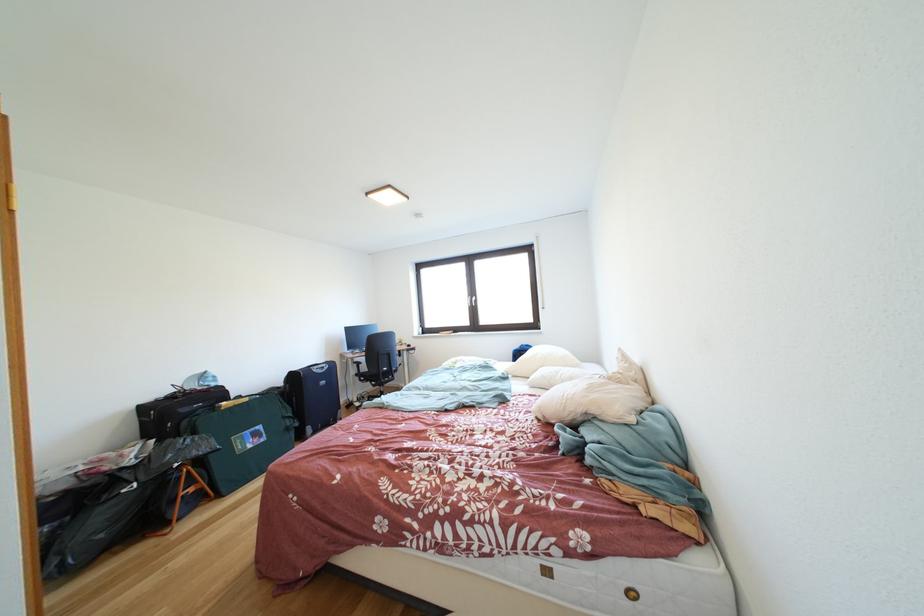
Identify the location of blue suitcase handle. (312, 397).